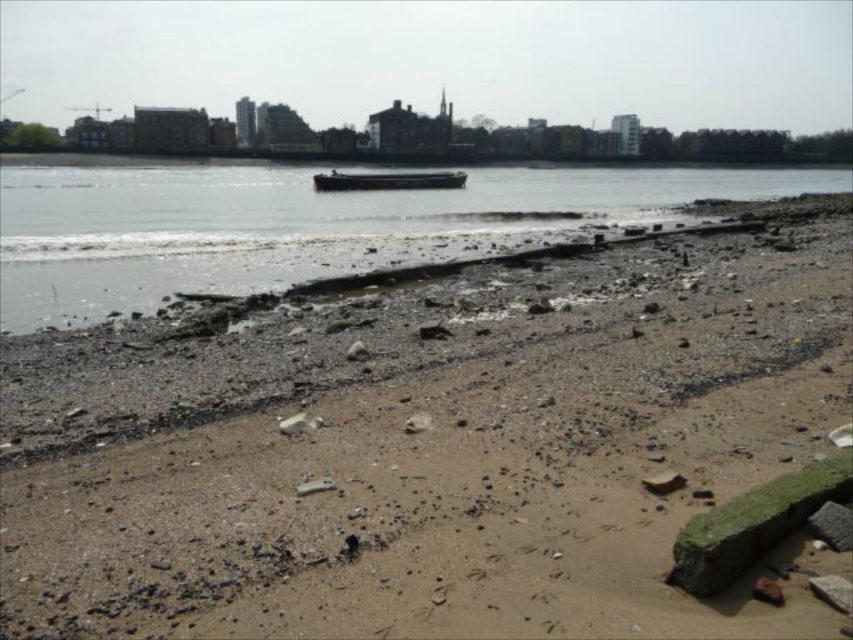
You are a boat operator planning to navigate a 10 meter wide boat through the area shown in the image. The boat requires a channel width of at least 12 meters to pass safely. Based on the scene, can the boat safely pass through the channel between the smooth water at center and the dark gray metallic barge at center?

The smooth water at center is wider than the dark gray metallic barge at center. However, the exact width of the channel isn generated in the provided information. Without knowing the actual width of the channel, it is impossible to determine if the boat can safely pass through.

You are standing at the beach and want to take a photo of two points marked in the image. The first point is at coordinate point (49,348) and the second is at point (323,257). Which point should you focus on first if you want to capture both in your shot without moving your camera?

You should focus on point (49,348) first since it is closer to the camera than point (323,257), ensuring both points are in focus when using a single focal point.